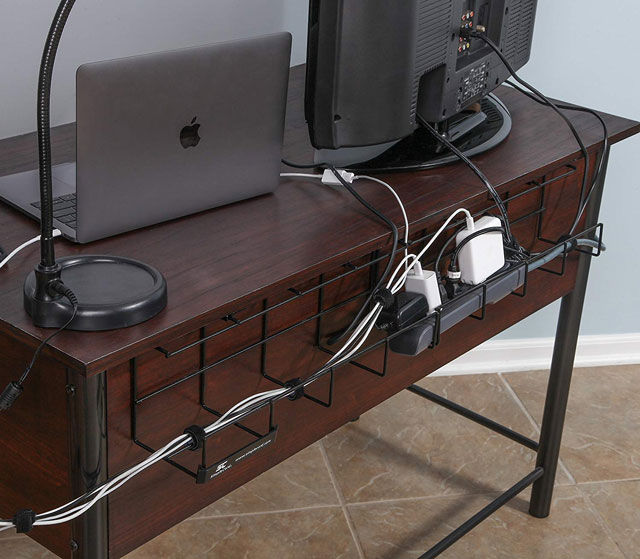
Image resolution: width=640 pixels, height=559 pixels. In order to click on cables and cords in this screenshot , I will do `click(301, 175)`, `click(349, 182)`, `click(492, 190)`, `click(566, 122)`, `click(602, 122)`, `click(591, 241)`, `click(54, 336)`, `click(13, 252)`.